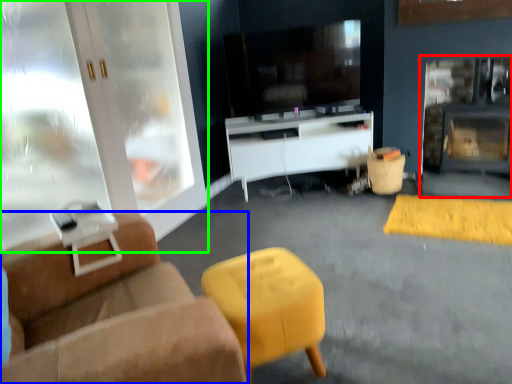
Question: Which object is the farthest from fireplace (highlighted by a red box)? Choose among these: studio couch (highlighted by a blue box) or cabinetry (highlighted by a green box).

Choices:
 (A) studio couch
 (B) cabinetry

Answer: (A)